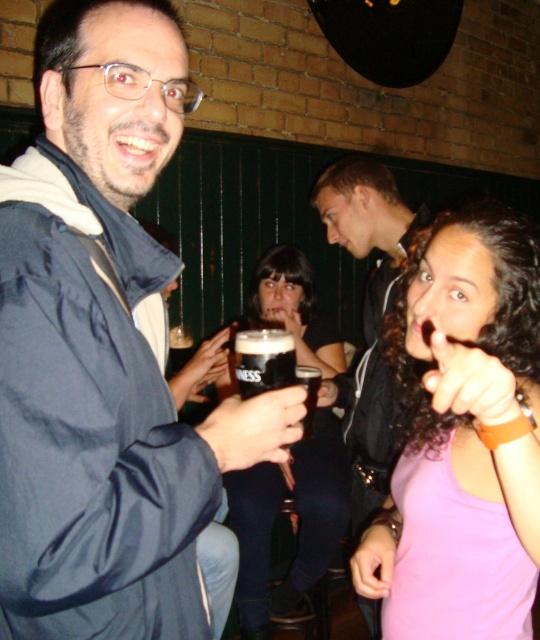
Question: Among these points, which one is farthest from the camera?

Choices:
 (A) (316, 384)
 (B) (262, 365)
 (C) (163, 3)
 (D) (272, 305)

Answer: (D)

Question: Based on their relative distances, which object is nearer to the black leather jacket at upper center?

Choices:
 (A) dark matte guinness pint at center
 (B) matte black glass at center

Answer: (B)

Question: Which of the following is the closest to the observer?

Choices:
 (A) (259, 353)
 (B) (315, 372)
 (C) (232, 419)

Answer: (C)

Question: Can you confirm if black leather jacket at upper center is wider than dark matte guinness pint at center?

Choices:
 (A) no
 (B) yes

Answer: (B)

Question: Where is blue nylon jacket at center located in relation to dark matte guinness pint at center in the image?

Choices:
 (A) left
 (B) right

Answer: (A)

Question: Does blue nylon jacket at center appear under black leather jacket at upper center?

Choices:
 (A) no
 (B) yes

Answer: (A)